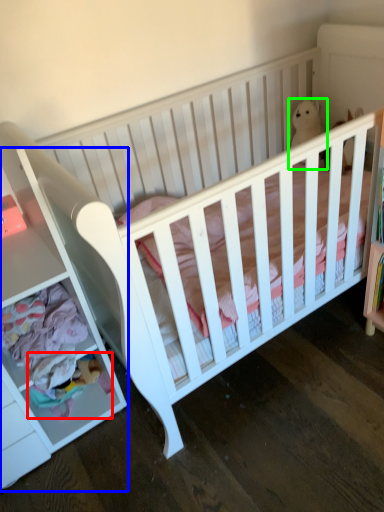
Question: Considering the real-world distances, which object is farthest from toy (highlighted by a red box)? dresser (highlighted by a blue box) or animal (highlighted by a green box)?

Choices:
 (A) dresser
 (B) animal

Answer: (B)